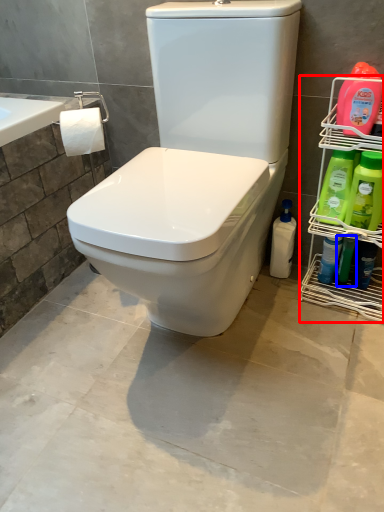
Question: Which point is further to the camera, shelf (highlighted by a red box) or cleaning product (highlighted by a blue box)?

Choices:
 (A) shelf
 (B) cleaning product

Answer: (B)